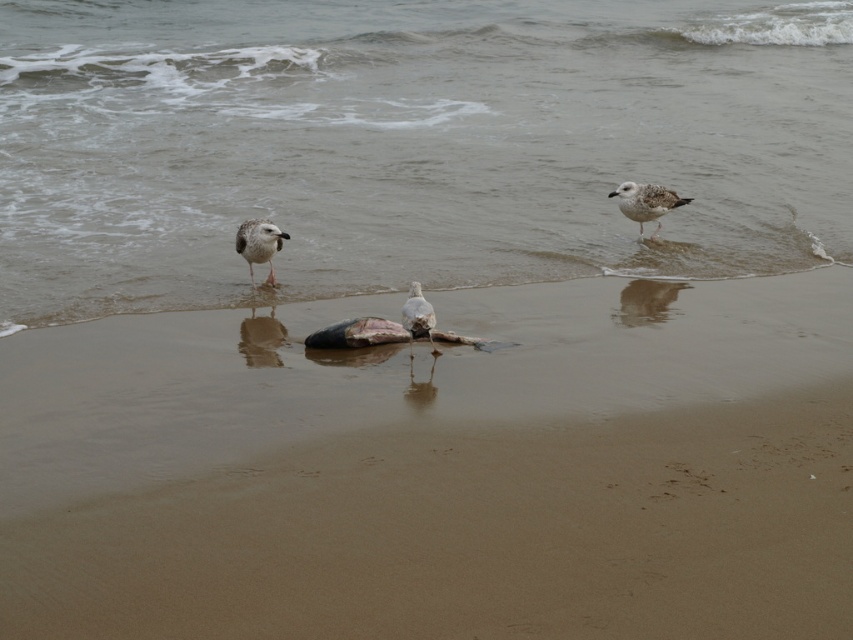
You are a photographer trying to capture the white feathered bird at center without including the dark object in the frame. Based on their positions, can you position yourself so that the smooth sand at center is between the bird and the dark object?

Yes, since the smooth sand at center is to the left of the white feathered bird at center, positioning yourself so that the sand is between the bird and the dark object would block the dark object from view.

You are a photographer aiming to capture the white feathered bird at center without the smooth sand at center appearing in the foreground. Is this possible given their positions?

The smooth sand at center is positioned under the white feathered bird at center, so it would be challenging to avoid the sand in the foreground as the bird is standing on it.